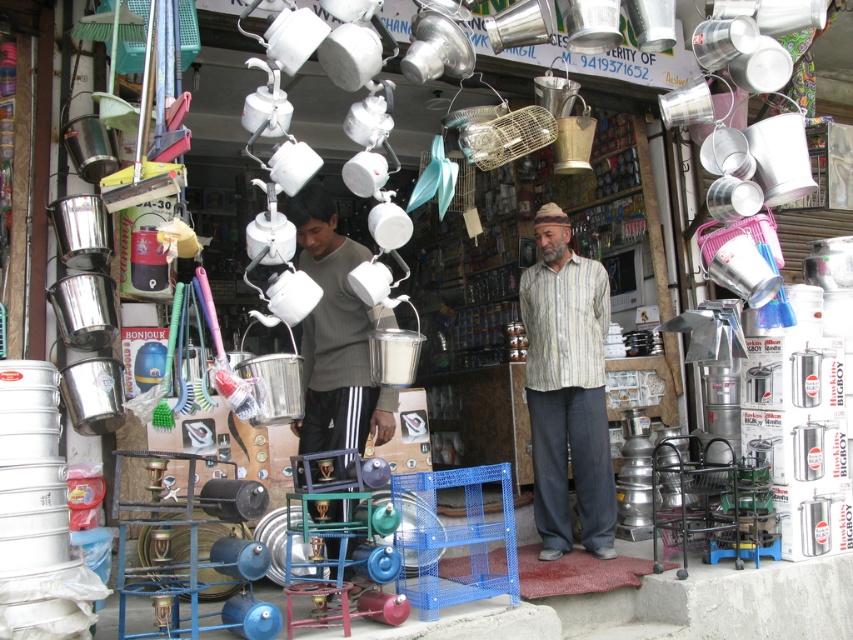
Question: Is striped cotton shirt at center closer to camera compared to gray sweater at center?

Choices:
 (A) yes
 (B) no

Answer: (B)

Question: Which point is farther from the camera taking this photo?

Choices:
 (A) (573, 353)
 (B) (379, 436)

Answer: (A)

Question: Which object is farther from the camera taking this photo?

Choices:
 (A) striped cotton shirt at center
 (B) gray sweater at center

Answer: (A)

Question: Can you confirm if striped cotton shirt at center is positioned to the right of gray sweater at center?

Choices:
 (A) yes
 (B) no

Answer: (A)

Question: Is striped cotton shirt at center thinner than gray sweater at center?

Choices:
 (A) no
 (B) yes

Answer: (B)